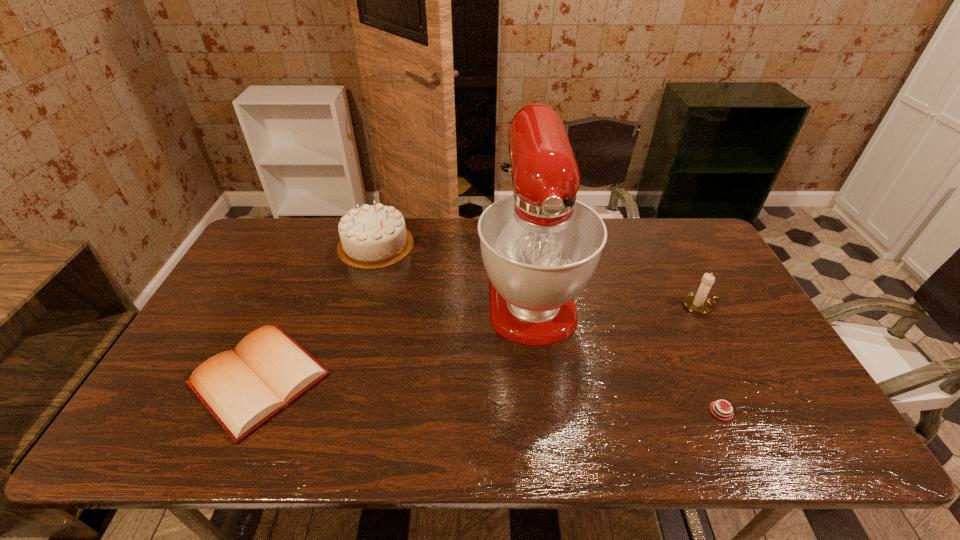
This screenshot has width=960, height=540. What are the coordinates of `the third object from right to left` in the screenshot? It's located at (540, 246).

This screenshot has width=960, height=540. I want to click on mixer, so click(x=540, y=246).

Locate an element on the screen. This screenshot has height=540, width=960. birthday cake is located at coordinates (372, 236).

The image size is (960, 540). What are the coordinates of `candle holder` in the screenshot? It's located at (699, 303).

This screenshot has height=540, width=960. Identify the location of Bible. (244, 388).

I want to click on chocolate cake, so click(727, 416).

Locate an element on the screen. Image resolution: width=960 pixels, height=540 pixels. vacant space situated at the attachment hub of the mixer is located at coordinates (545, 415).

This screenshot has height=540, width=960. I want to click on blank area located 0.120m on the right of the birthday cake, so click(x=448, y=245).

Find the location of a particular element. The width and height of the screenshot is (960, 540). blank space located on the handle side of the candle holder is located at coordinates (736, 305).

This screenshot has width=960, height=540. Find the location of `vacant point located on the back of the fourth tallest object`. vacant point located on the back of the fourth tallest object is located at coordinates (314, 255).